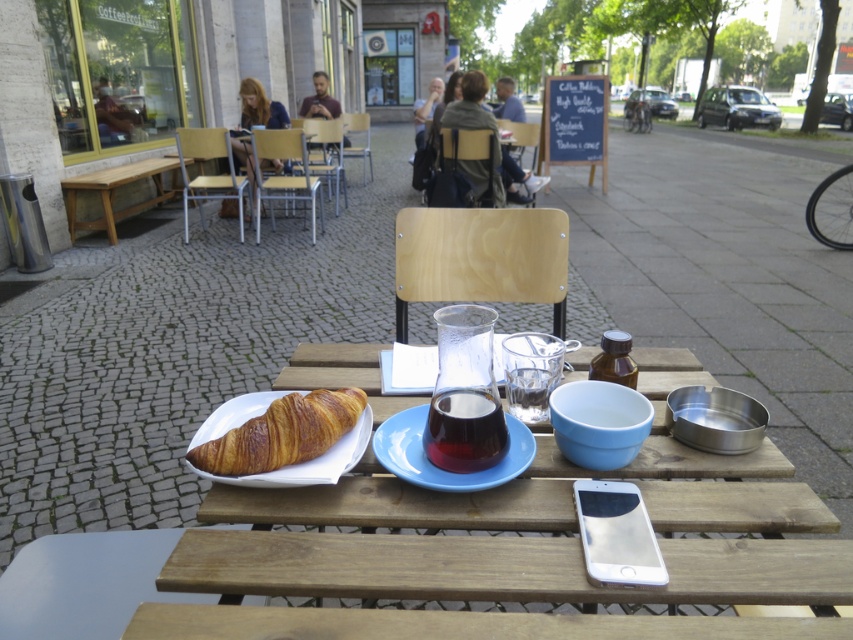
Does wooden picnic table at center have a smaller size compared to light brown wooden bench at left?

Yes, wooden picnic table at center is smaller than light brown wooden bench at left.

Is wooden picnic table at center above light brown wooden bench at left?

No.

Which is in front, point (280, 376) or point (62, 186)?

Positioned in front is point (280, 376).

Locate an element on the screen. Image resolution: width=853 pixels, height=640 pixels. wooden picnic table at center is located at coordinates (712, 470).

Who is shorter, blue matte plate at center or translucent glass beverage at center?

blue matte plate at center is shorter.

Between blue matte plate at center and translucent glass beverage at center, which one appears on the left side from the viewer's perspective?

Positioned to the left is blue matte plate at center.

At what (x,y) coordinates should I click in order to perform the action: click on blue matte plate at center. Please return your answer as a coordinate pair (x, y). The height and width of the screenshot is (640, 853). Looking at the image, I should click on (433, 464).

Identify the location of blue matte plate at center. This screenshot has width=853, height=640. (433, 464).

Who is positioned more to the right, golden brown flaky croissant at lower left or blue matte plate at center?

Positioned to the right is blue matte plate at center.

Does golden brown flaky croissant at lower left have a greater height compared to blue matte plate at center?

Yes, golden brown flaky croissant at lower left is taller than blue matte plate at center.

Which is in front, point (286, 451) or point (517, 432)?

Point (286, 451)

Where is `golden brown flaky croissant at lower left`? golden brown flaky croissant at lower left is located at coordinates (281, 433).